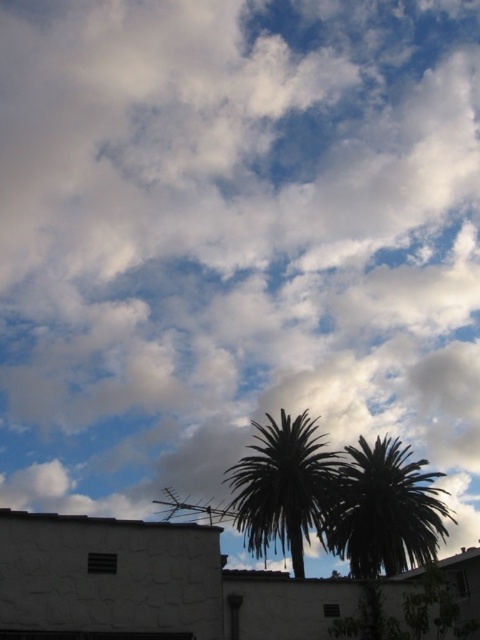
Can you confirm if green leafy palm tree at center is positioned below green leafy palm at center?

Yes.

Image resolution: width=480 pixels, height=640 pixels. What do you see at coordinates (384, 509) in the screenshot?
I see `green leafy palm tree at center` at bounding box center [384, 509].

Between point (375, 509) and point (303, 532), which one is positioned in front?

Positioned in front is point (375, 509).

You are a GUI agent. You are given a task and a screenshot of the screen. Output one action in this format:
    pyautogui.click(x=<x>, y=<y>)
    Task: Click on the green leafy palm tree at center
    The width and height of the screenshot is (480, 640).
    Given the screenshot: What is the action you would take?
    pyautogui.click(x=384, y=509)